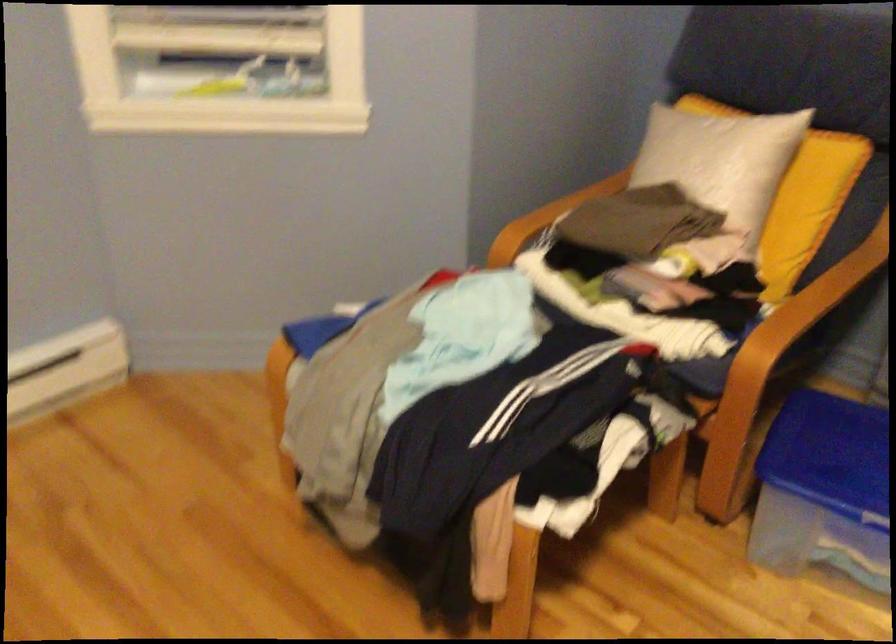
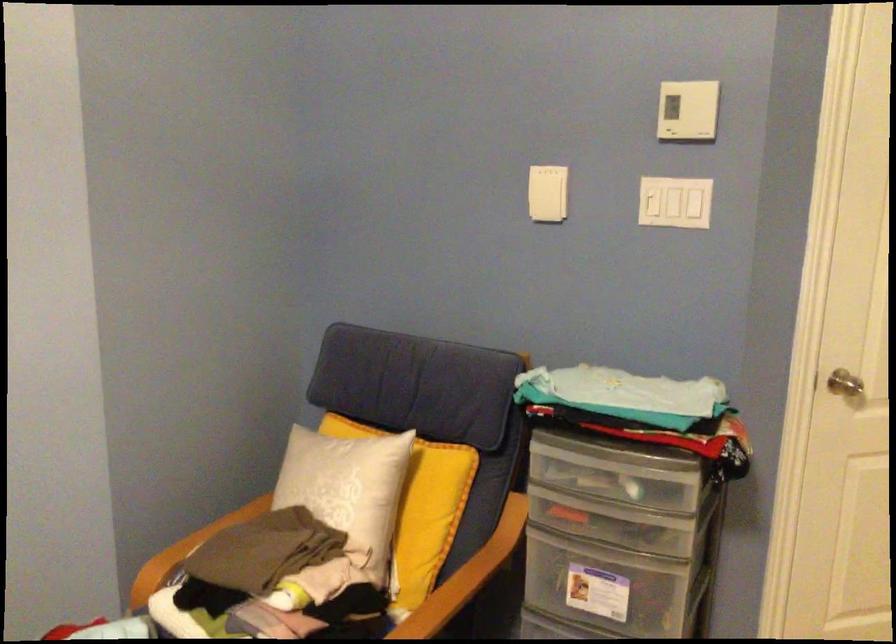
Where in the second image is the point corresponding to point 796,199 from the first image?

(419, 507)